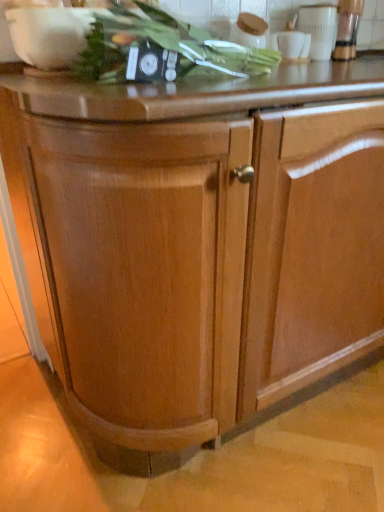
Question: Should I look upward or downward to see white glossy cup at upper right, which is the 1th appliance from left to right?

Choices:
 (A) down
 (B) up

Answer: (B)

Question: Is white glossy cup at upper right, which is the 1th appliance from left to right, bigger than metallic silver blender at upper right, the second appliance in the left-to-right sequence?

Choices:
 (A) yes
 (B) no

Answer: (A)

Question: Is metallic silver blender at upper right, arranged as the first appliance when viewed from the right, completely or partially inside white glossy cup at upper right, which is the 1th appliance from left to right?

Choices:
 (A) no
 (B) yes

Answer: (A)

Question: Is the depth of white glossy cup at upper right, which is counted as the 2th appliance, starting from the right, greater than that of metallic silver blender at upper right, the second appliance in the left-to-right sequence?

Choices:
 (A) yes
 (B) no

Answer: (B)

Question: Does white glossy cup at upper right, which is counted as the 2th appliance, starting from the right, appear on the right side of metallic silver blender at upper right, the second appliance in the left-to-right sequence?

Choices:
 (A) no
 (B) yes

Answer: (A)

Question: From the image's perspective, is white glossy cup at upper right, which is the 1th appliance from left to right, on metallic silver blender at upper right, arranged as the first appliance when viewed from the right?

Choices:
 (A) yes
 (B) no

Answer: (B)

Question: Can you confirm if white glossy cup at upper right, which is the 1th appliance from left to right, is taller than metallic silver blender at upper right, arranged as the first appliance when viewed from the right?

Choices:
 (A) no
 (B) yes

Answer: (A)

Question: Is green leafy vegetable at upper center a part of white glossy cup at upper right, which is the 1th appliance from left to right?

Choices:
 (A) yes
 (B) no

Answer: (B)

Question: From a real-world perspective, does white glossy cup at upper right, which is the 1th appliance from left to right, stand above green leafy vegetable at upper center?

Choices:
 (A) no
 (B) yes

Answer: (B)

Question: Is white glossy cup at upper right, which is the 1th appliance from left to right, positioned behind green leafy vegetable at upper center?

Choices:
 (A) no
 (B) yes

Answer: (B)

Question: Is white glossy cup at upper right, which is the 1th appliance from left to right, outside of green leafy vegetable at upper center?

Choices:
 (A) no
 (B) yes

Answer: (B)

Question: Can you confirm if white glossy cup at upper right, which is counted as the 2th appliance, starting from the right, is shorter than green leafy vegetable at upper center?

Choices:
 (A) yes
 (B) no

Answer: (B)

Question: From a real-world perspective, is white glossy cup at upper right, which is the 1th appliance from left to right, under green leafy vegetable at upper center?

Choices:
 (A) yes
 (B) no

Answer: (B)

Question: From the image's perspective, is green leafy vegetable at upper center below metallic silver blender at upper right, arranged as the first appliance when viewed from the right?

Choices:
 (A) no
 (B) yes

Answer: (B)